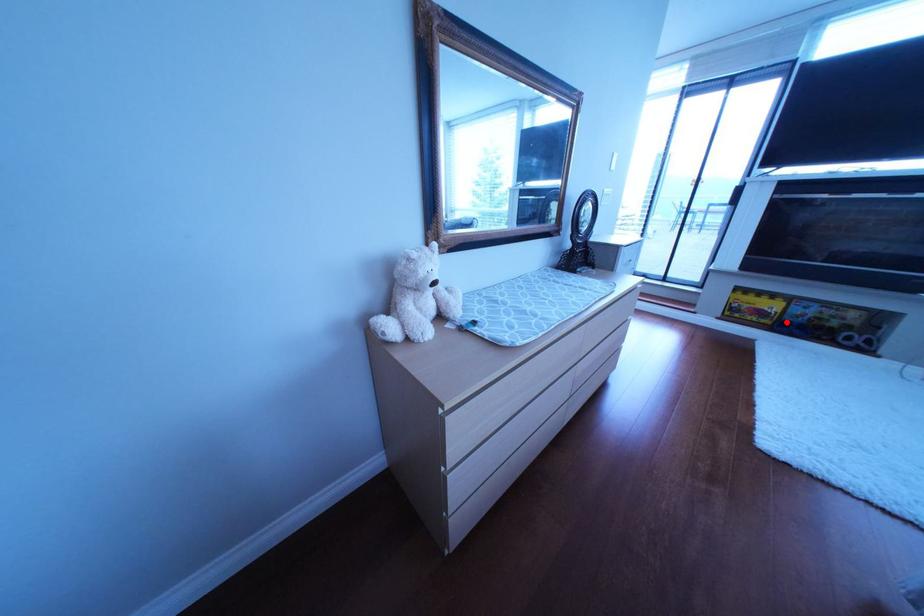
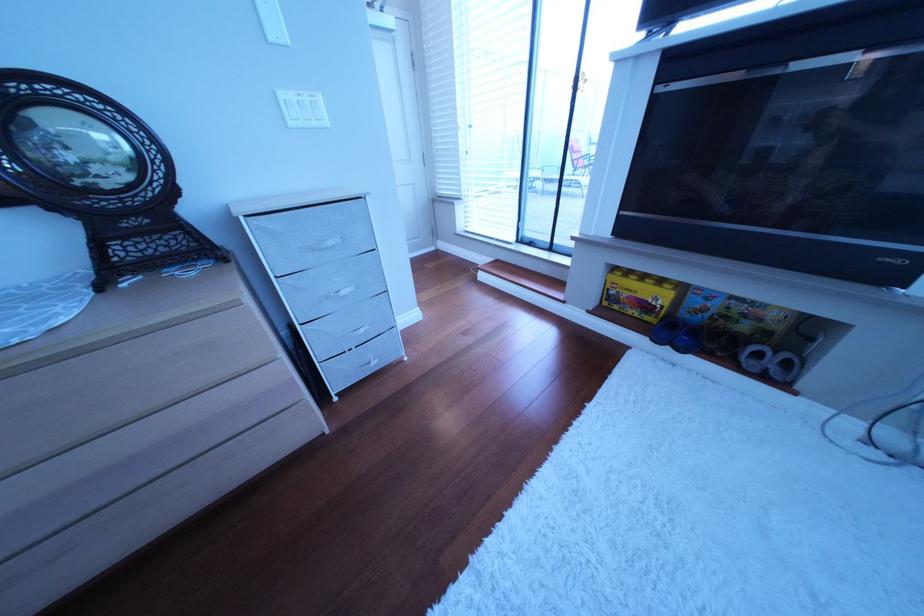
Question: A red point is marked in image1. In image2, is the corresponding 3D point closer to the camera or farther? Reply with the corresponding letter.

Choices:
 (A) The corresponding 3D point is closer.
 (B) The corresponding 3D point is farther.

Answer: (A)